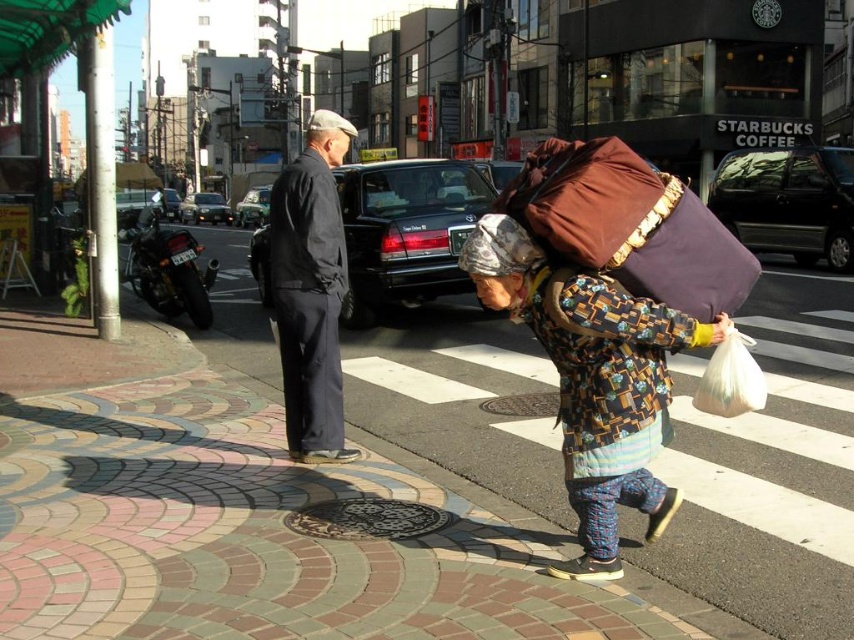
Based on the photo, you are a delivery person who needs to place a package on the sidewalk. The package must be placed exactly at the location of the brown fabric bag at center. According to the scene, where should you position the package?

The brown fabric bag at center is located at point (629, 225), so you should position the package at those coordinates.

In the scene shown: You are a delivery person who needs to determine which item is larger between the brown fabric bag at center and the camouflage fabric headscarf at center. Which one should you choose to place in your larger delivery box?

The brown fabric bag at center is bigger than the camouflage fabric headscarf at center, so you should choose the brown fabric bag at center to place in your larger delivery box.